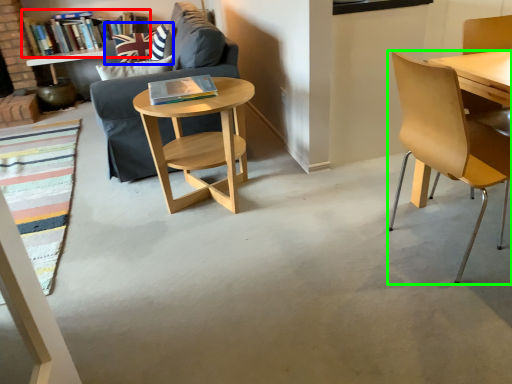
Question: Which object is the closest to the book (highlighted by a red box)? Choose among these: pillow (highlighted by a blue box) or chair (highlighted by a green box).

Choices:
 (A) pillow
 (B) chair

Answer: (A)